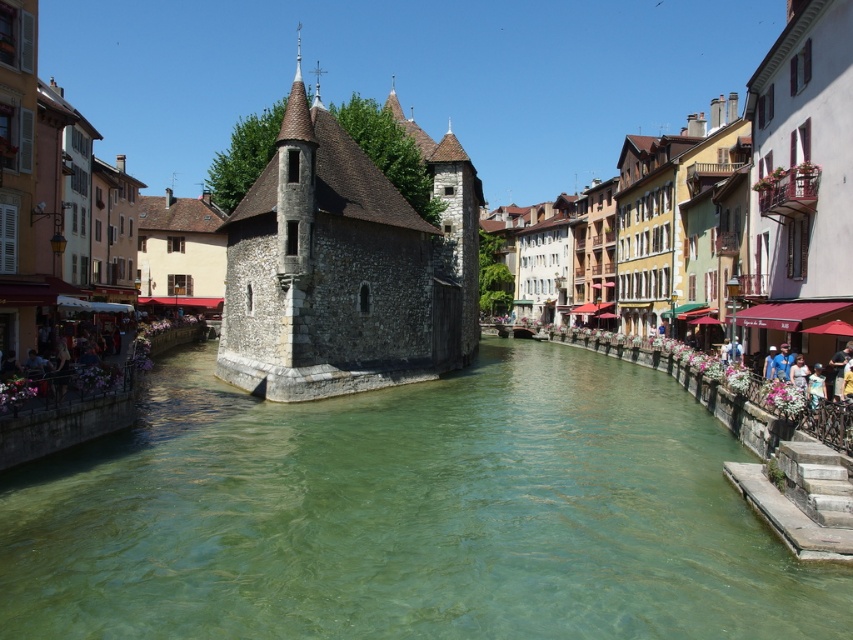
Question: Does green stone water at center appear under stone building at center?

Choices:
 (A) no
 (B) yes

Answer: (B)

Question: Which of the following is the farthest from the observer?

Choices:
 (A) stone tower at center
 (B) stone building at center
 (C) green stone water at center

Answer: (A)

Question: Which object is closer to the camera taking this photo?

Choices:
 (A) stone tower at center
 (B) green stone water at center
 (C) stone building at center

Answer: (B)

Question: Which object is closer to the camera taking this photo?

Choices:
 (A) green stone water at center
 (B) stone tower at center

Answer: (A)

Question: Does green stone water at center appear over stone building at center?

Choices:
 (A) yes
 (B) no

Answer: (B)

Question: Can you confirm if green stone water at center is positioned to the left of stone tower at center?

Choices:
 (A) no
 (B) yes

Answer: (A)